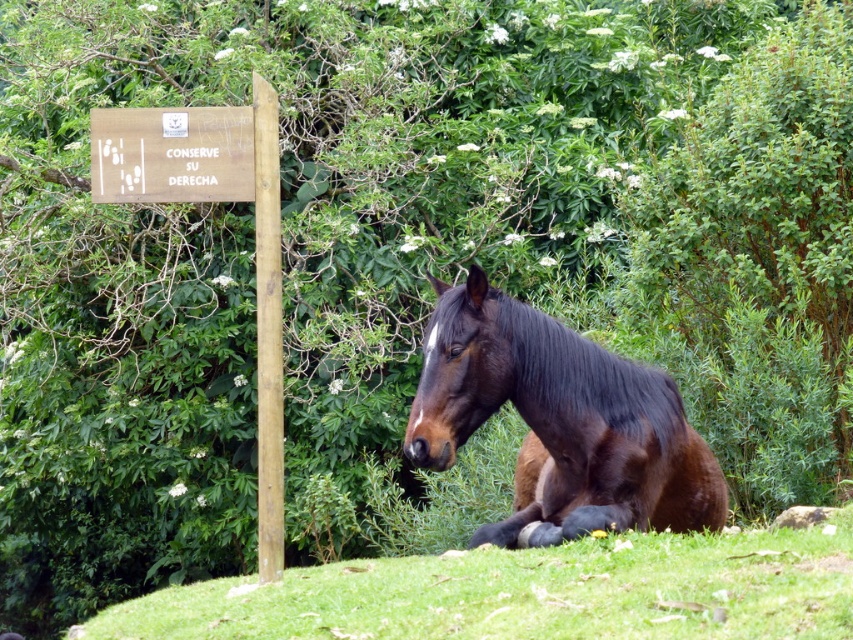
Question: Which of the following is the closest to the observer?

Choices:
 (A) (466, 307)
 (B) (109, 177)
 (C) (281, 609)
 (D) (271, 477)

Answer: (C)

Question: Does green grass at lower right appear on the right side of shiny brown horse at center?

Choices:
 (A) yes
 (B) no

Answer: (A)

Question: Which point is closer to the camera?

Choices:
 (A) green grass at lower right
 (B) shiny brown horse at center
 (C) light brown wooden post at left
 (D) wooden sign at upper left

Answer: (A)

Question: Among these objects, which one is nearest to the camera?

Choices:
 (A) wooden sign at upper left
 (B) light brown wooden post at left

Answer: (B)

Question: Is wooden sign at upper left wider than light brown wooden post at left?

Choices:
 (A) no
 (B) yes

Answer: (B)

Question: Is green grass at lower right positioned behind shiny brown horse at center?

Choices:
 (A) yes
 (B) no

Answer: (B)